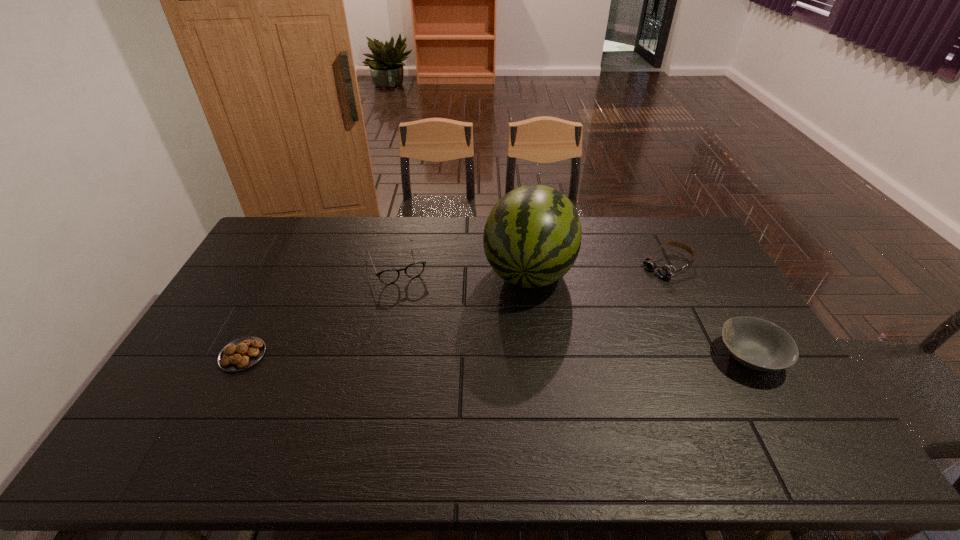
At what (x,y) coordinates should I click in order to perform the action: click on the third closest object to the second object from left to right. Please return your answer as a coordinate pair (x, y). This screenshot has width=960, height=540. Looking at the image, I should click on (665, 271).

At what (x,y) coordinates should I click in order to perform the action: click on the closest object relative to the tallest object. Please return your answer as a coordinate pair (x, y). Looking at the image, I should click on (389, 276).

Identify the location of vacant space that satisfies the following two spatial constraints: 1. on the front side of the fourth object from right to left; 2. on the right side of the tallest object. (395, 271).

Identify the location of free region that satisfies the following two spatial constraints: 1. on the back side of the goggles; 2. on the left side of the shortest object. Image resolution: width=960 pixels, height=540 pixels. (289, 266).

Where is `free spot that satisfies the following two spatial constraints: 1. on the front side of the third object from left to right; 2. on the right side of the fourth shortest object`? This screenshot has height=540, width=960. free spot that satisfies the following two spatial constraints: 1. on the front side of the third object from left to right; 2. on the right side of the fourth shortest object is located at coordinates (540, 357).